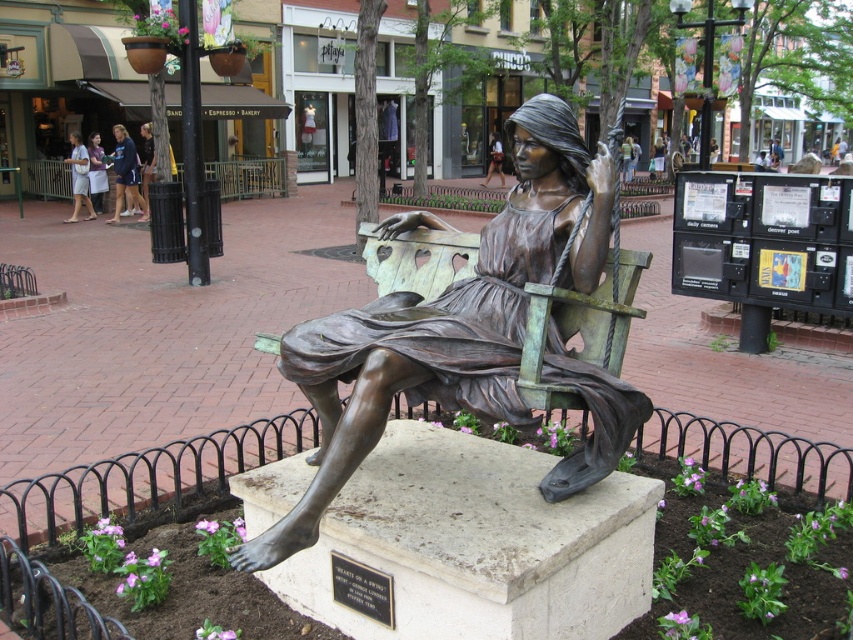
You are an artist preparing to sketch the scene of the bronze statue in the plaza. You notice the white cotton shorts at left and the light brown leather jacket at upper center. Which object should you draw first if you want to focus on the larger item in the scene?

The light brown leather jacket at upper center should be drawn first because it occupies more space than the white cotton shorts at left.